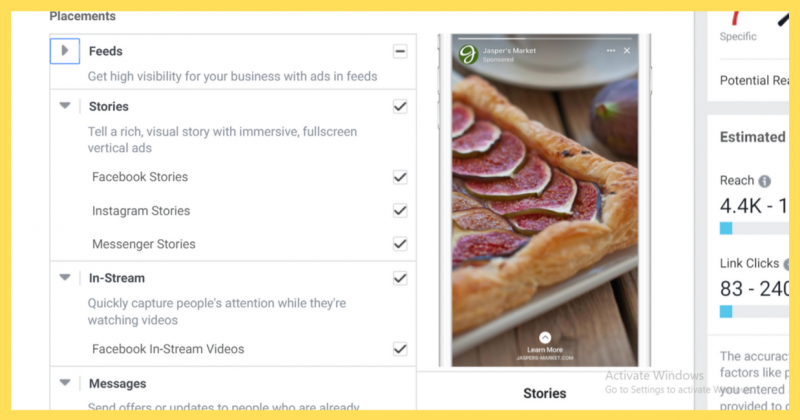
You are a GUI agent. You are given a task and a screenshot of the screen. Output one action in this format:
    pyautogui.click(x=<x>, y=<y>)
    Task: Click on the picture
    This screenshot has height=420, width=800.
    Given the screenshot: What is the action you would take?
    pyautogui.click(x=548, y=86)